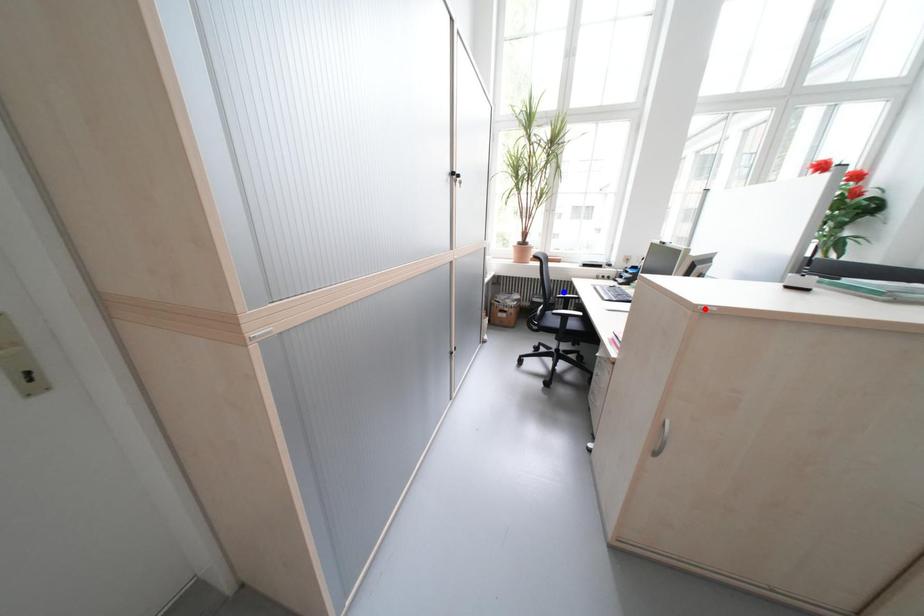
Question: In the image, two points are highlighted. Which point is nearer to the camera? Reply with the corresponding letter.

Choices:
 (A) blue point
 (B) red point

Answer: (B)